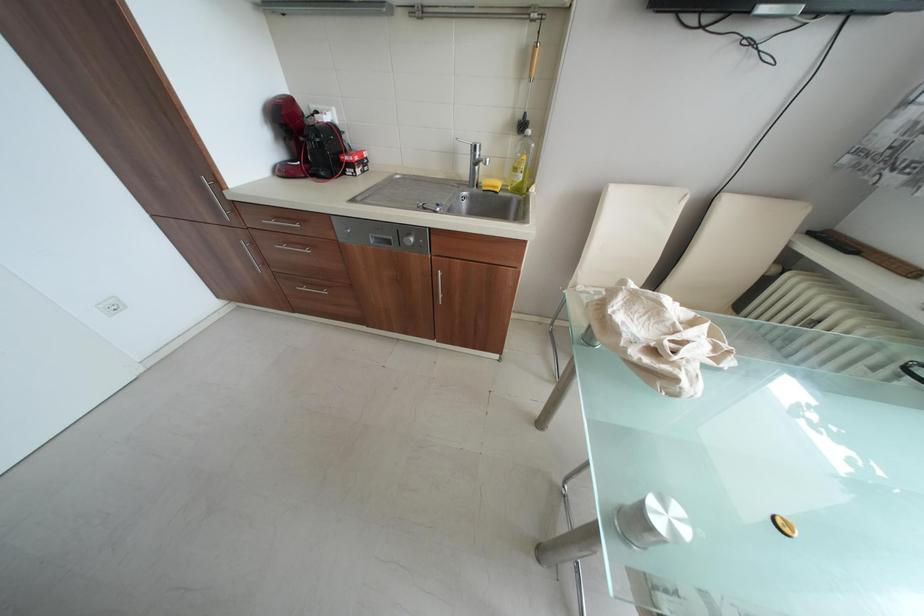
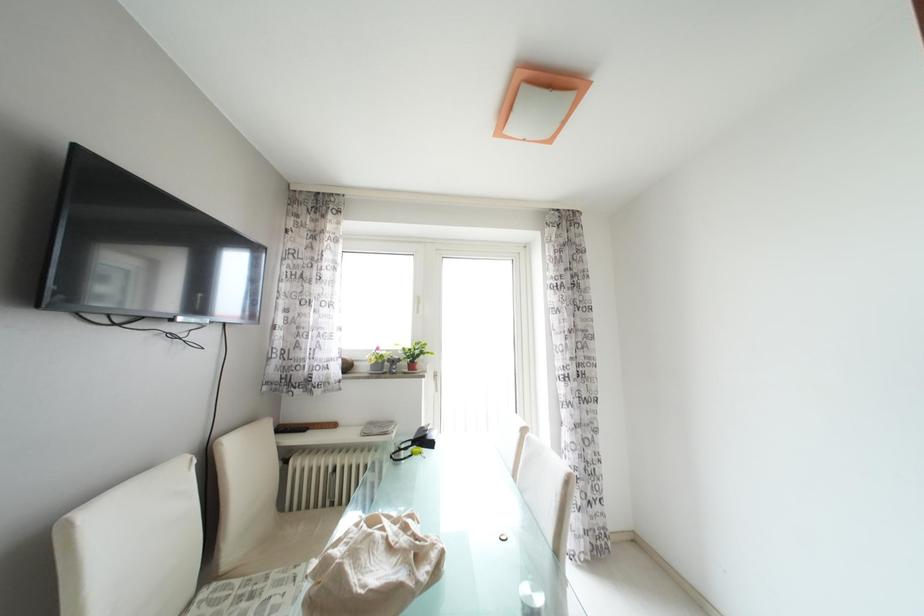
Question: The camera is either moving clockwise (left) or counter-clockwise (right) around the object. The first image is from the beginning of the video and the second image is from the end. Is the camera moving left or right when shooting the video?

Choices:
 (A) Left
 (B) Right

Answer: (A)